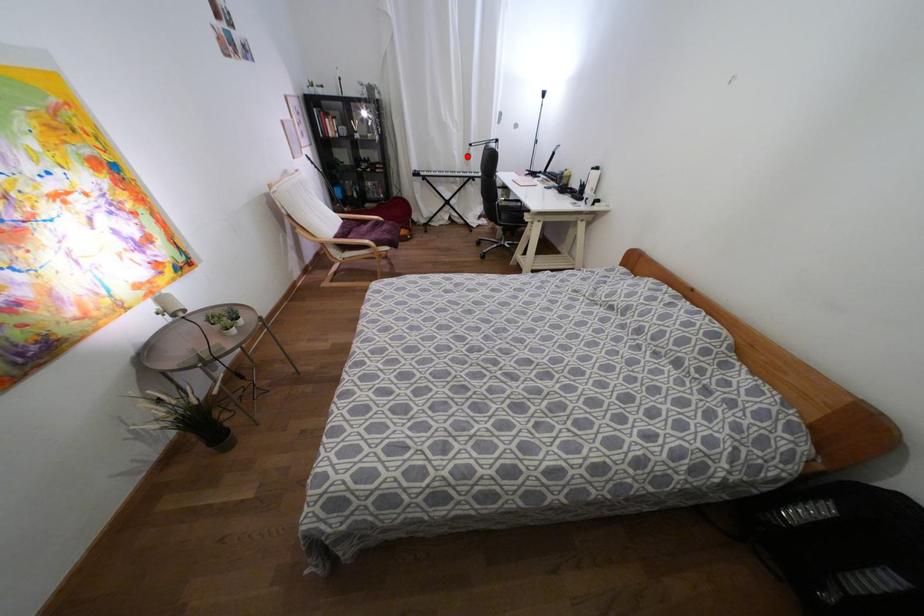
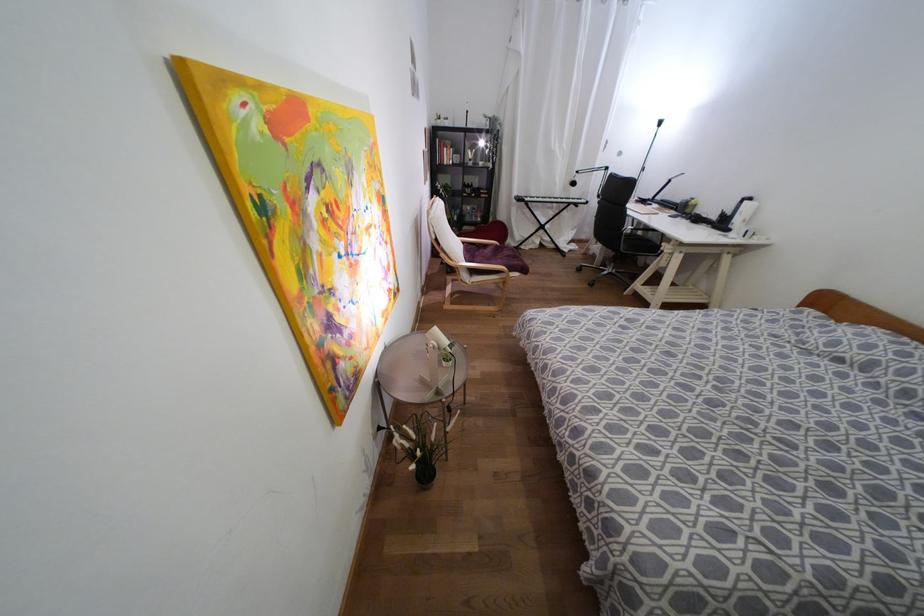
Where in the second image is the point corresponding to the highlighted location from the first image?

(573, 183)